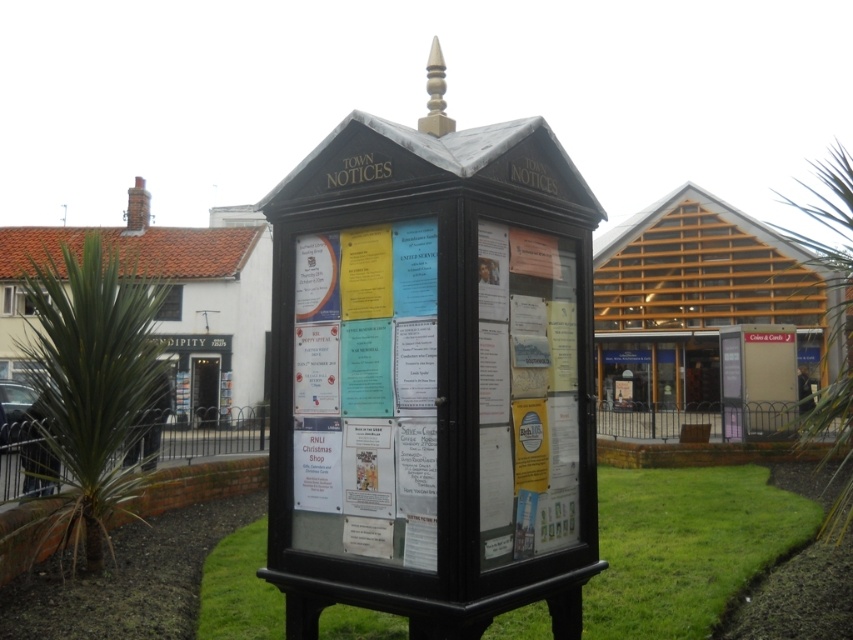
Question: Which point appears closest to the camera in this image?

Choices:
 (A) (341, 348)
 (B) (807, 534)

Answer: (A)

Question: Does white paper posters at center come in front of green grass at lower center?

Choices:
 (A) yes
 (B) no

Answer: (A)

Question: Which object appears closest to the camera in this image?

Choices:
 (A) white paper posters at center
 (B) green grass at lower center

Answer: (A)

Question: Can you confirm if white paper posters at center is thinner than green grass at lower center?

Choices:
 (A) yes
 (B) no

Answer: (B)

Question: Can you confirm if white paper posters at center is positioned below green grass at lower center?

Choices:
 (A) yes
 (B) no

Answer: (B)